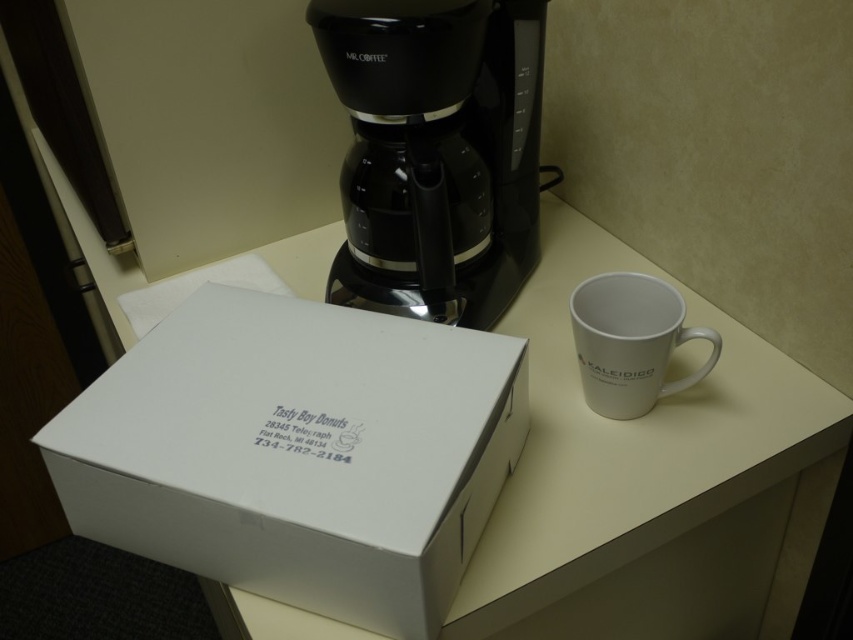
Can you confirm if black plastic coffee maker at center is positioned to the left of white ceramic mug at right?

Yes, black plastic coffee maker at center is to the left of white ceramic mug at right.

Which is behind, point (521, 196) or point (589, 348)?

Point (521, 196)

Locate an element on the screen. This screenshot has height=640, width=853. black plastic coffee maker at center is located at coordinates point(436,152).

Is point (524, 372) positioned before point (531, 259)?

Yes, it is.

Does white cardboard box at center have a larger size compared to black plastic coffee maker at center?

No.

Find the location of a particular element. The image size is (853, 640). white cardboard box at center is located at coordinates (299, 452).

Identify the location of white cardboard box at center. (299, 452).

This screenshot has height=640, width=853. I want to click on white cardboard box at center, so click(x=299, y=452).

Between point (279, 506) and point (474, 580), which one is positioned in front?

Point (279, 506) is more forward.

At what (x,y) coordinates should I click in order to perform the action: click on white cardboard box at center. Please return your answer as a coordinate pair (x, y). This screenshot has height=640, width=853. Looking at the image, I should click on (299, 452).

This screenshot has height=640, width=853. In order to click on white cardboard box at center in this screenshot , I will do tap(299, 452).